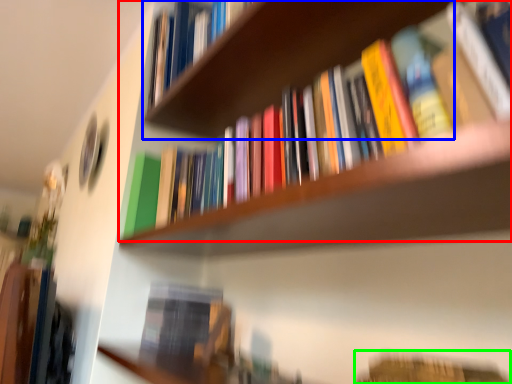
Question: Which object is positioned farthest from book (highlighted by a red box)? Select from cabinet (highlighted by a blue box) and book (highlighted by a green box).

Choices:
 (A) cabinet
 (B) book

Answer: (B)